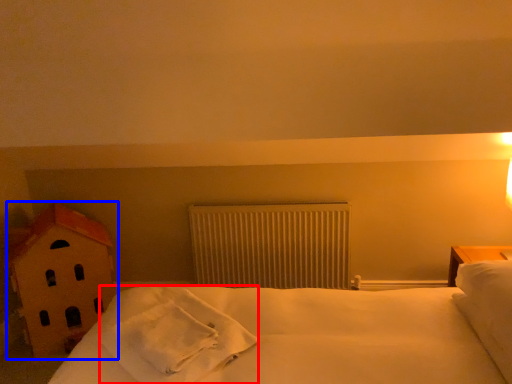
Question: Which object is further to the camera taking this photo, material (highlighted by a red box) or toy (highlighted by a blue box)?

Choices:
 (A) material
 (B) toy

Answer: (B)